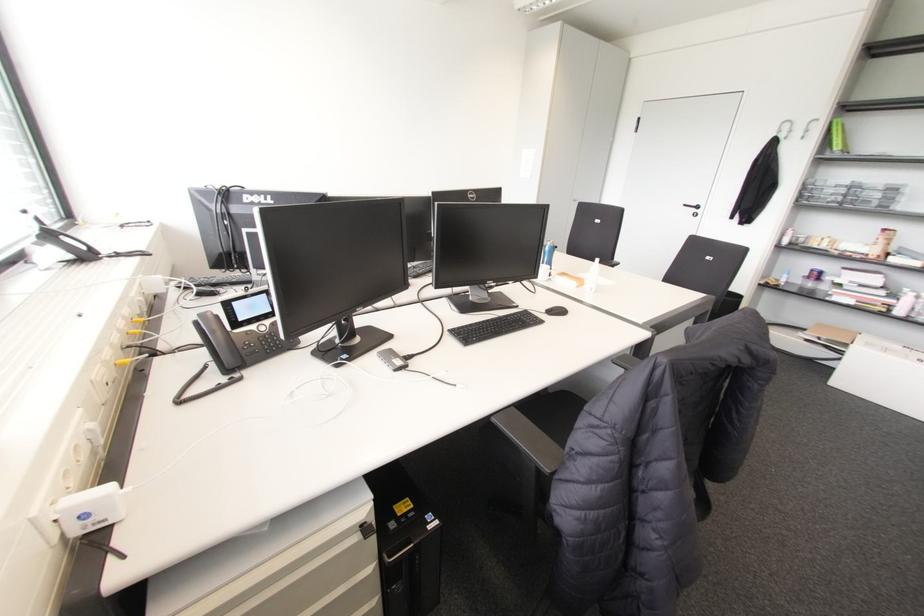
Which object does [591,276] point to?

It corresponds to the white spray bottle in the image.